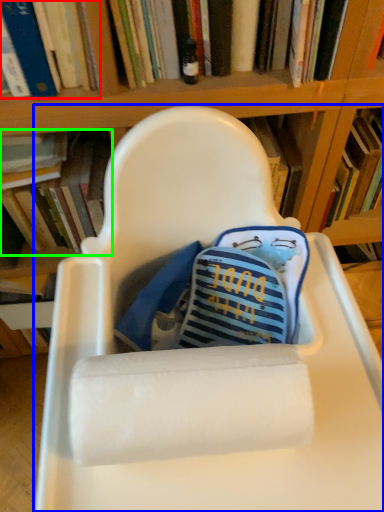
Question: Based on their relative distances, which object is nearer to book (highlighted by a red box)? Choose from chair (highlighted by a blue box) and book (highlighted by a green box).

Choices:
 (A) chair
 (B) book

Answer: (B)